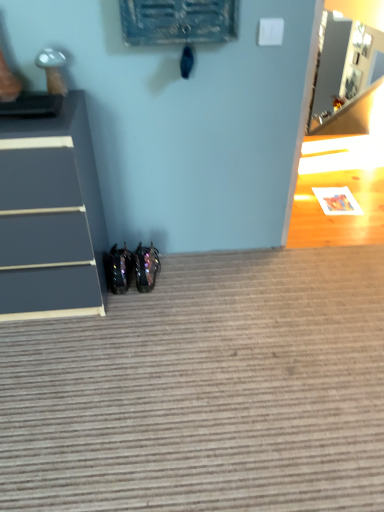
Consider the image. In order to face textured gray carpet at lower center, should I rotate leftwards or rightwards?

You should rotate right by 4.453 degrees.

Image resolution: width=384 pixels, height=512 pixels. In order to click on matte gray chest of drawers at left in this screenshot , I will do `click(50, 214)`.

This screenshot has width=384, height=512. I want to click on glossy metallic shoes at lower center, placed as the 1th footwear when sorted from right to left, so click(x=146, y=267).

How much distance is there between matte gray chest of drawers at left and glossy black shoes at lower center, which is the 2th footwear from right to left?

A distance of 38.80 centimeters exists between matte gray chest of drawers at left and glossy black shoes at lower center, which is the 2th footwear from right to left.

Between matte gray chest of drawers at left and glossy black shoes at lower center, which is the 2th footwear from right to left, which one has larger size?

Bigger between the two is matte gray chest of drawers at left.

Which is more to the left, matte gray chest of drawers at left or glossy black shoes at lower center, which is counted as the 1th footwear, starting from the left?

matte gray chest of drawers at left.

Considering the positions of points (41, 190) and (121, 259), is point (41, 190) closer to camera compared to point (121, 259)?

Yes, it is in front of point (121, 259).

Who is shorter, glossy black shoes at lower center, which is the 2th footwear from right to left, or glossy metallic shoes at lower center, the 2th footwear in the left-to-right sequence?

glossy black shoes at lower center, which is the 2th footwear from right to left.

Find the location of a particular element. The image size is (384, 512). footwear on the right of glossy black shoes at lower center, which is counted as the 1th footwear, starting from the left is located at coordinates (146, 267).

From a real-world perspective, which object rests below the other?

From a 3D spatial view, glossy black shoes at lower center, which is counted as the 1th footwear, starting from the left, is below.

Is glossy metallic shoes at lower center, the 2th footwear in the left-to-right sequence, positioned beyond the bounds of glossy black shoes at lower center, which is the 2th footwear from right to left?

glossy metallic shoes at lower center, the 2th footwear in the left-to-right sequence, is positioned outside glossy black shoes at lower center, which is the 2th footwear from right to left.

Considering their positions, is glossy metallic shoes at lower center, placed as the 1th footwear when sorted from right to left, located in front of or behind glossy black shoes at lower center, which is the 2th footwear from right to left?

glossy metallic shoes at lower center, placed as the 1th footwear when sorted from right to left, is behind glossy black shoes at lower center, which is the 2th footwear from right to left.

Does glossy metallic shoes at lower center, the 2th footwear in the left-to-right sequence, turn towards glossy black shoes at lower center, which is counted as the 1th footwear, starting from the left?

No, glossy metallic shoes at lower center, the 2th footwear in the left-to-right sequence, is not facing towards glossy black shoes at lower center, which is counted as the 1th footwear, starting from the left.

This screenshot has width=384, height=512. Identify the location of footwear that appears on the left of glossy metallic shoes at lower center, placed as the 1th footwear when sorted from right to left. (118, 268).

How distant is textured gray carpet at lower center from matte gray chest of drawers at left?

textured gray carpet at lower center is 19.72 inches from matte gray chest of drawers at left.

Is point (123, 321) in front of point (91, 228)?

Yes, point (123, 321) is in front of point (91, 228).

Is textured gray carpet at lower center turned away from matte gray chest of drawers at left?

No, textured gray carpet at lower center's orientation is not away from matte gray chest of drawers at left.

Which object is positioned more to the right, textured gray carpet at lower center or matte gray chest of drawers at left?

textured gray carpet at lower center.

Are glossy metallic shoes at lower center, the 2th footwear in the left-to-right sequence, and matte gray chest of drawers at left making contact?

glossy metallic shoes at lower center, the 2th footwear in the left-to-right sequence, and matte gray chest of drawers at left are not in contact.

Can you confirm if glossy metallic shoes at lower center, placed as the 1th footwear when sorted from right to left, is positioned to the right of matte gray chest of drawers at left?

Indeed, glossy metallic shoes at lower center, placed as the 1th footwear when sorted from right to left, is positioned on the right side of matte gray chest of drawers at left.

Is glossy metallic shoes at lower center, placed as the 1th footwear when sorted from right to left, wider or thinner than matte gray chest of drawers at left?

In the image, glossy metallic shoes at lower center, placed as the 1th footwear when sorted from right to left, appears to be more narrow than matte gray chest of drawers at left.

Would you say matte gray chest of drawers at left is to the left or to the right of textured gray carpet at lower center in the picture?

In the image, matte gray chest of drawers at left appears on the left side of textured gray carpet at lower center.

From a real-world perspective, which object stands above the other?

matte gray chest of drawers at left is physically above.

Measure the distance from matte gray chest of drawers at left to textured gray carpet at lower center.

They are 19.72 inches apart.

Find the location of a particular element. chest of drawers above the textured gray carpet at lower center (from a real-world perspective) is located at coordinates (50, 214).

Looking at this image, does glossy black shoes at lower center, which is counted as the 1th footwear, starting from the left, have a larger size compared to textured gray carpet at lower center?

No.

Is glossy black shoes at lower center, which is the 2th footwear from right to left, taller than textured gray carpet at lower center?

Indeed, glossy black shoes at lower center, which is the 2th footwear from right to left, has a greater height compared to textured gray carpet at lower center.

Considering the positions of objects glossy black shoes at lower center, which is the 2th footwear from right to left, and textured gray carpet at lower center in the image provided, who is behind, glossy black shoes at lower center, which is the 2th footwear from right to left, or textured gray carpet at lower center?

glossy black shoes at lower center, which is the 2th footwear from right to left, is more distant.

This screenshot has width=384, height=512. In order to click on the 2nd footwear below the matte gray chest of drawers at left (from a real-world perspective) in this screenshot , I will do `click(118, 268)`.

This screenshot has height=512, width=384. What are the coordinates of `footwear behind the glossy black shoes at lower center, which is the 2th footwear from right to left` in the screenshot? It's located at (146, 267).

From the image, which object appears to be nearer to glossy metallic shoes at lower center, placed as the 1th footwear when sorted from right to left, matte gray chest of drawers at left or textured gray carpet at lower center?

matte gray chest of drawers at left.

Estimate the real-world distances between objects in this image. Which object is further from textured gray carpet at lower center, glossy metallic shoes at lower center, the 2th footwear in the left-to-right sequence, or matte gray chest of drawers at left?

The object further to textured gray carpet at lower center is glossy metallic shoes at lower center, the 2th footwear in the left-to-right sequence.

Considering their positions, is textured gray carpet at lower center positioned further to glossy metallic shoes at lower center, the 2th footwear in the left-to-right sequence, than matte gray chest of drawers at left?

Among the two, textured gray carpet at lower center is located further to glossy metallic shoes at lower center, the 2th footwear in the left-to-right sequence.

Considering their positions, is matte gray chest of drawers at left positioned further to glossy black shoes at lower center, which is the 2th footwear from right to left, than glossy metallic shoes at lower center, the 2th footwear in the left-to-right sequence?

matte gray chest of drawers at left lies further to glossy black shoes at lower center, which is the 2th footwear from right to left, than the other object.

Considering their positions, is glossy black shoes at lower center, which is counted as the 1th footwear, starting from the left, positioned further to glossy metallic shoes at lower center, placed as the 1th footwear when sorted from right to left, than textured gray carpet at lower center?

Based on the image, textured gray carpet at lower center appears to be further to glossy metallic shoes at lower center, placed as the 1th footwear when sorted from right to left.

Which object lies nearer to the anchor point textured gray carpet at lower center, glossy metallic shoes at lower center, the 2th footwear in the left-to-right sequence, or glossy black shoes at lower center, which is counted as the 1th footwear, starting from the left?

Based on the image, glossy metallic shoes at lower center, the 2th footwear in the left-to-right sequence, appears to be nearer to textured gray carpet at lower center.

Estimate the real-world distances between objects in this image. Which object is further from glossy black shoes at lower center, which is counted as the 1th footwear, starting from the left, matte gray chest of drawers at left or textured gray carpet at lower center?

textured gray carpet at lower center is further to glossy black shoes at lower center, which is counted as the 1th footwear, starting from the left.

When comparing their distances from matte gray chest of drawers at left, does glossy metallic shoes at lower center, the 2th footwear in the left-to-right sequence, or textured gray carpet at lower center seem closer?

Based on the image, glossy metallic shoes at lower center, the 2th footwear in the left-to-right sequence, appears to be nearer to matte gray chest of drawers at left.

The width and height of the screenshot is (384, 512). What are the coordinates of `footwear located between textured gray carpet at lower center and glossy metallic shoes at lower center, placed as the 1th footwear when sorted from right to left, in the depth direction` in the screenshot? It's located at (118, 268).

Find the location of a particular element. The width and height of the screenshot is (384, 512). footwear between matte gray chest of drawers at left and glossy metallic shoes at lower center, the 2th footwear in the left-to-right sequence, in the front-back direction is located at coordinates (118, 268).